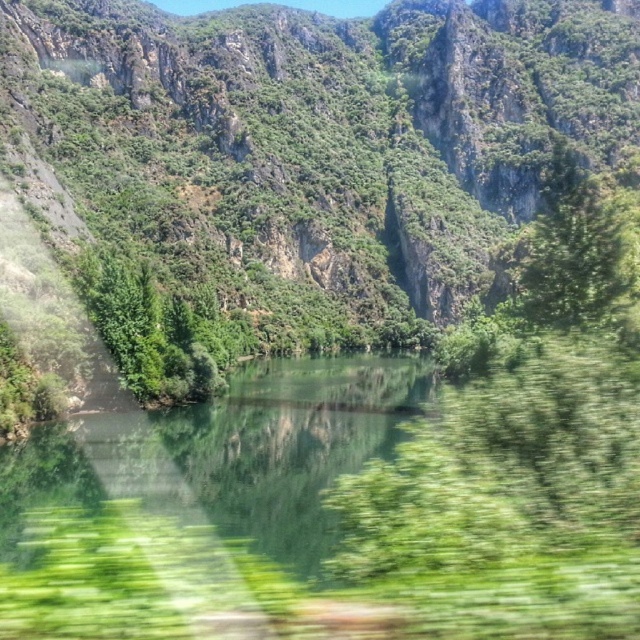
Does green rocky mountain at center have a smaller size compared to green leafy tree at upper right?

No.

Where is `green rocky mountain at center`? green rocky mountain at center is located at coordinates (314, 140).

Which is above, green rocky mountain at center or green leafy tree at center-left?

green rocky mountain at center

Is point (106, 52) positioned in front of point (122, 368)?

No, it is not.

Who is more forward, (138,65) or (224,368)?

Point (224,368) is more forward.

The height and width of the screenshot is (640, 640). In order to click on green rocky mountain at center in this screenshot , I will do `click(314, 140)`.

Between green leafy tree at center-left and green leafy tree at upper right, which one appears on the left side from the viewer's perspective?

green leafy tree at center-left is more to the left.

In the scene shown: Who is more forward, (150, 340) or (584, 204)?

Positioned in front is point (584, 204).

The image size is (640, 640). I want to click on green leafy tree at center-left, so click(x=154, y=330).

Locate an element on the screen. The image size is (640, 640). green leafy tree at center-left is located at coordinates (154, 330).